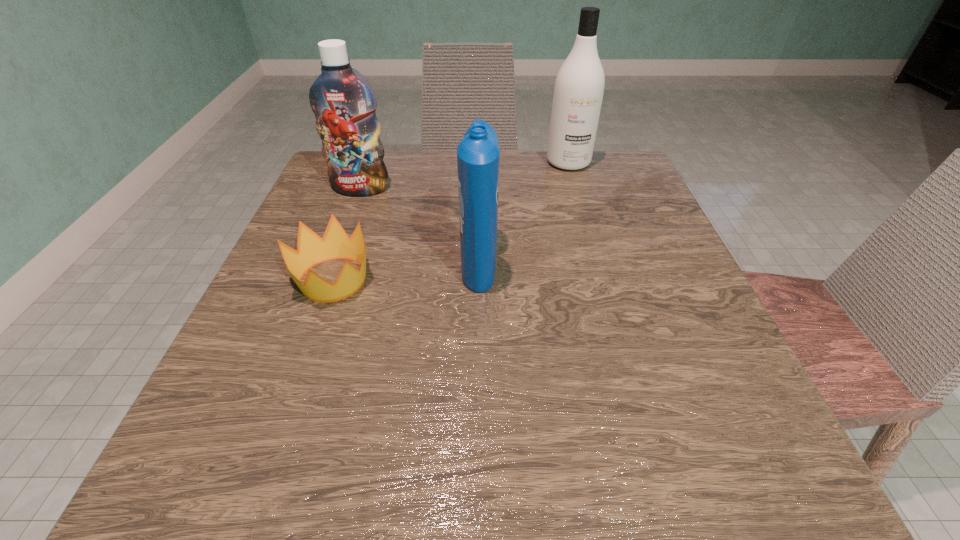
Locate an element on the screen. This screenshot has height=540, width=960. vacant space situated on the right of the shortest object is located at coordinates (570, 279).

Find the location of `shampoo located at the left edge`. shampoo located at the left edge is located at coordinates (344, 104).

Locate an element on the screen. This screenshot has height=540, width=960. crown located in the left edge section of the desktop is located at coordinates (311, 249).

You are a GUI agent. You are given a task and a screenshot of the screen. Output one action in this format:
    pyautogui.click(x=<x>, y=<y>)
    Task: Click on the object present at the right edge
    Image resolution: width=960 pixels, height=540 pixels.
    Given the screenshot: What is the action you would take?
    pyautogui.click(x=579, y=86)

I want to click on object that is at the far left corner, so click(x=344, y=104).

This screenshot has height=540, width=960. What are the coordinates of `object present at the far right corner` in the screenshot? It's located at (579, 86).

Where is `vacant space at the far edge of the desktop`? vacant space at the far edge of the desktop is located at coordinates (560, 187).

Identify the location of vacant space at the near edge of the desktop. The width and height of the screenshot is (960, 540). (427, 490).

Where is `vacant space at the left edge of the desktop`? Image resolution: width=960 pixels, height=540 pixels. vacant space at the left edge of the desktop is located at coordinates (262, 322).

You are a GUI agent. You are given a task and a screenshot of the screen. Output one action in this format:
    pyautogui.click(x=<x>, y=<y>)
    Task: Click on the free space at the right edge of the desktop
    The width and height of the screenshot is (960, 540).
    Given the screenshot: What is the action you would take?
    pyautogui.click(x=651, y=227)